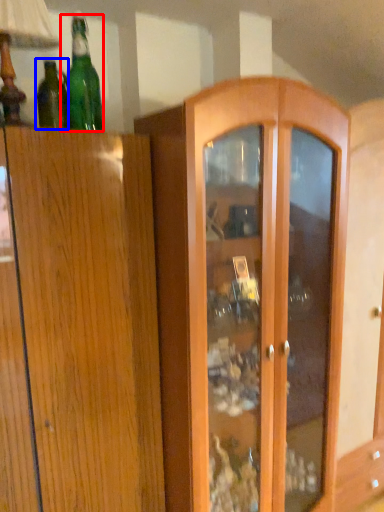
Question: Which object appears closest to the camera in this image, bottle (highlighted by a red box) or bottle (highlighted by a blue box)?

Choices:
 (A) bottle
 (B) bottle

Answer: (A)